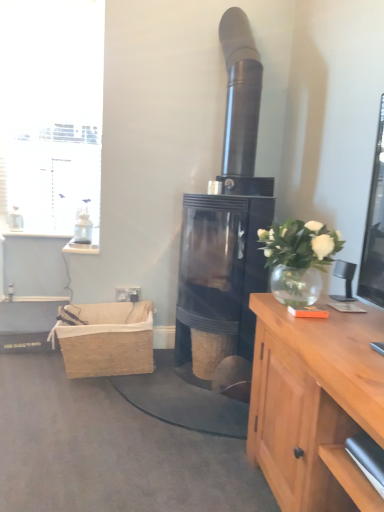
Locate an element on the screen. vacant space situated on the left part of woven brown basket at center is located at coordinates (177, 370).